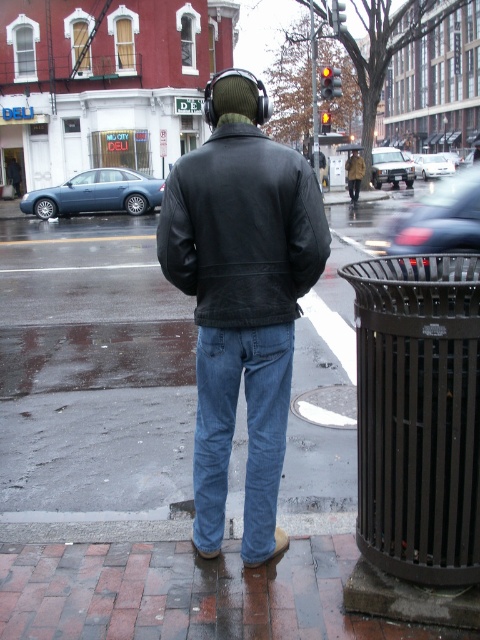
Question: Is matte black leather jacket at center thinner than metallic silver car at right?

Choices:
 (A) no
 (B) yes

Answer: (B)

Question: Is black leather jacket at center wider than metallic silver sedan at center?

Choices:
 (A) yes
 (B) no

Answer: (B)

Question: Is metallic silver sedan at center to the left of camouflage fabric jacket at center from the viewer's perspective?

Choices:
 (A) yes
 (B) no

Answer: (B)

Question: Which of the following is the closest to the observer?

Choices:
 (A) (219, 278)
 (B) (447, 164)
 (C) (205, 496)
 (D) (355, 176)

Answer: (A)

Question: Estimate the real-world distances between objects in this image. Which object is farther from the white glossy sedan at center?

Choices:
 (A) metallic silver sedan at center
 (B) matte blue sedan at left
 (C) black leather jacket at center
 (D) denim jeans at center

Answer: (C)

Question: Considering the real-world distances, which object is closest to the matte blue sedan at left?

Choices:
 (A) blue denim jeans at center
 (B) camouflage fabric jacket at center
 (C) metallic silver sedan at center

Answer: (A)